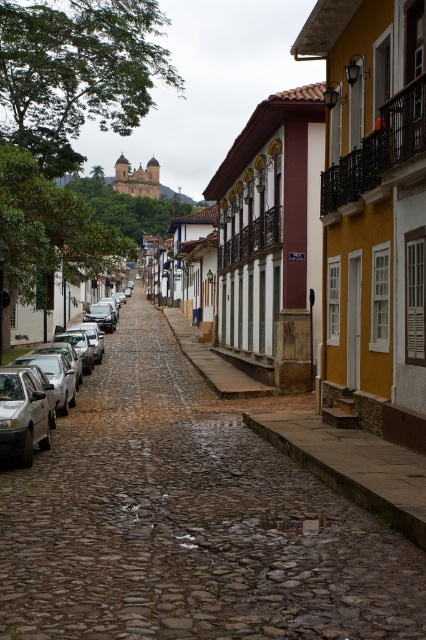
You are standing at the entrance of a cobblestone alley in a historic Brazilian town. Your goal is to reach the cobblestone alley at center marked by point (189, 520). Which direction should you walk to reach it?

You should walk forward towards the cobblestone alley at center marked by point (189, 520) as it is directly ahead of you in the center of the street.

You are a photographer planning to capture a wide shot of the cobblestone street. You have a camera that can only focus on objects wider than 2 meters. The yellow painted wall at right and the silver metallic car at left are both in your frame. Based on their widths, will both objects be in focus?

The yellow painted wall at right has a lesser width compared to silver metallic car at left. Since the camera requires objects wider than 2 meters to focus, only the silver metallic car at left may be in focus if its width exceeds 2 meters. The yellow painted wall at right might be too narrow to be focused on.